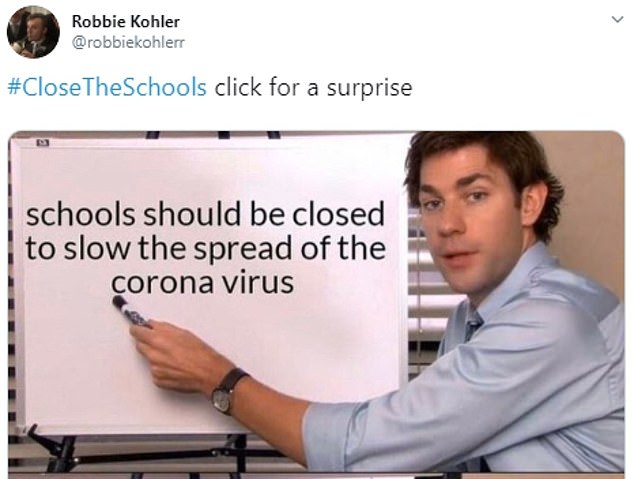
The image size is (634, 479). In order to click on blinds in this screenshot , I will do `click(424, 296)`.